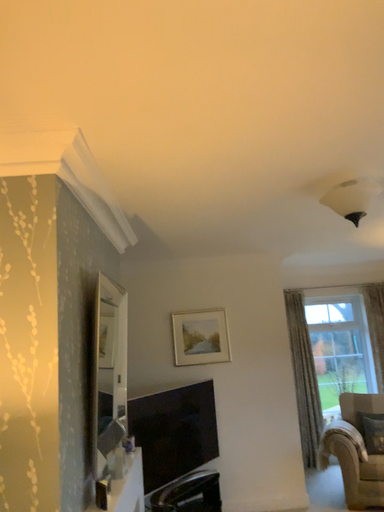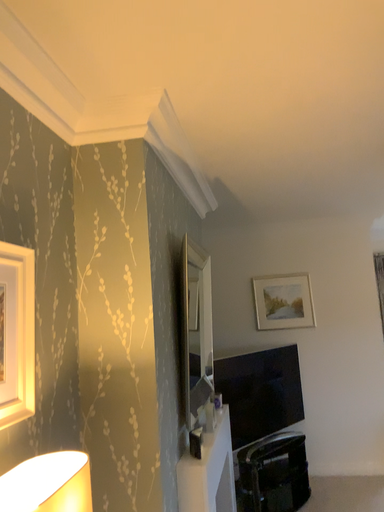
Question: How did the camera likely rotate when shooting the video?

Choices:
 (A) rotated right
 (B) rotated left

Answer: (B)